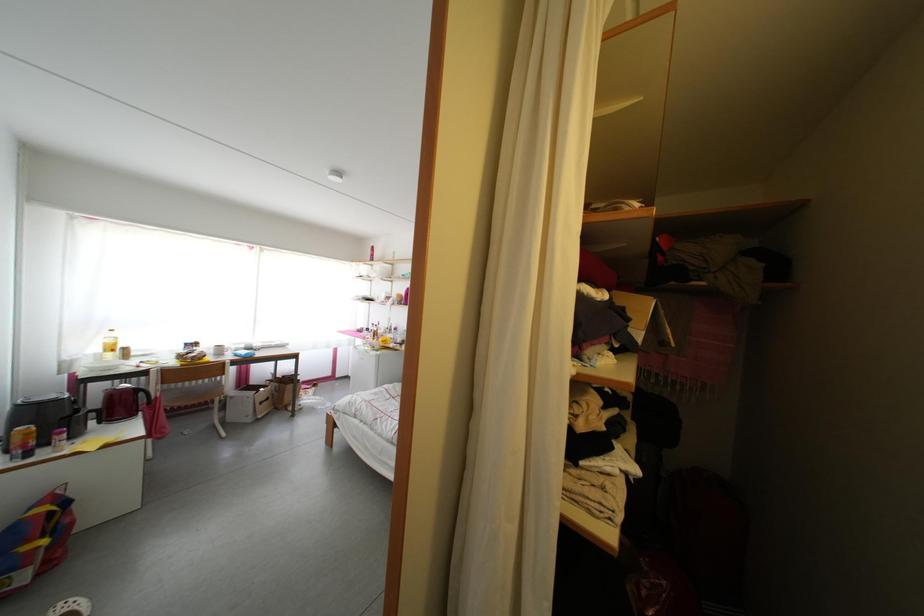
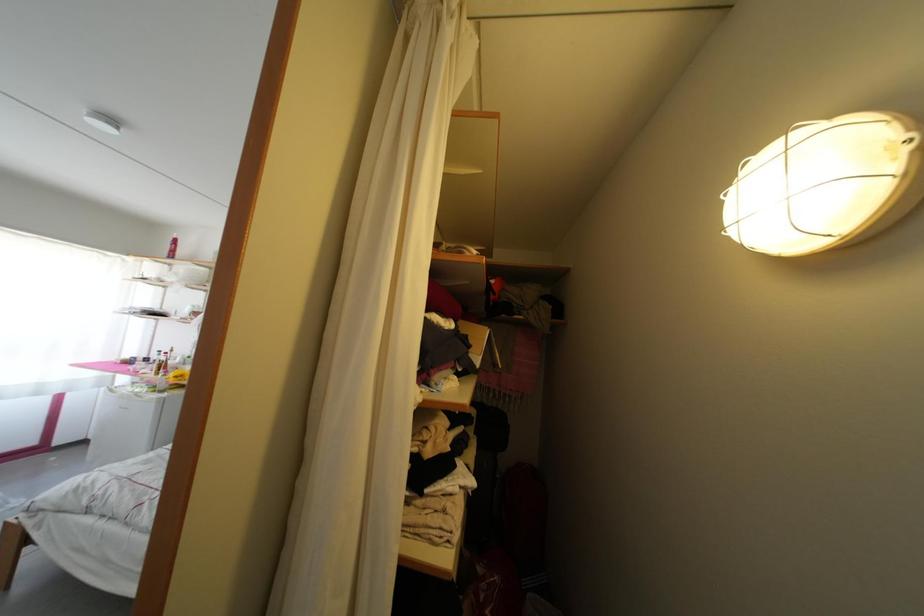
Question: Based on the continuous images, in which direction is the camera rotating? Reply with the corresponding letter.

Choices:
 (A) Left
 (B) Right
 (C) Up
 (D) Down

Answer: (B)